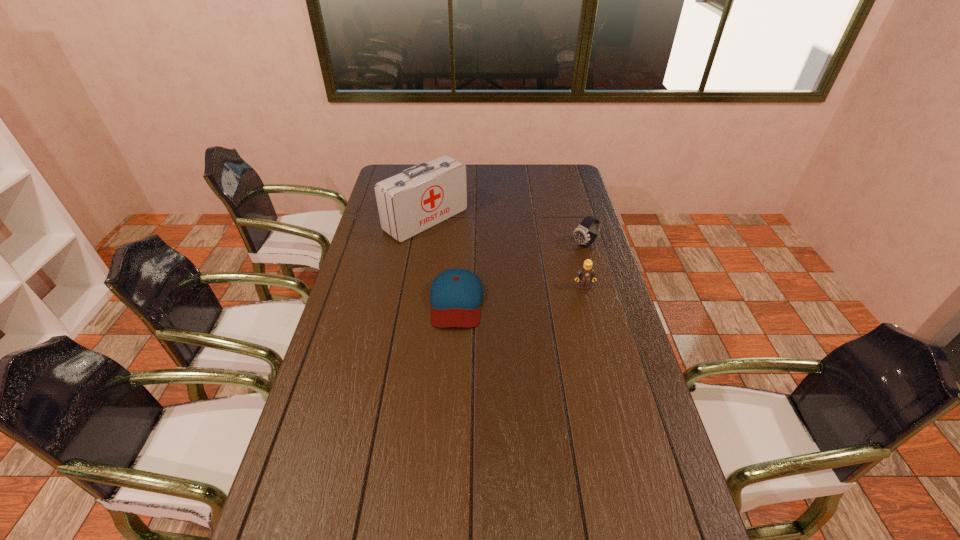
Image resolution: width=960 pixels, height=540 pixels. In order to click on free space on the desktop that is between the baseball cap and the Lego and is positioned on the front-facing side of the tallest object in this screenshot , I will do `click(534, 293)`.

Identify the location of vacant spot on the desktop that is between the baseball cap and the Lego and is positioned on the face of the watch. (508, 295).